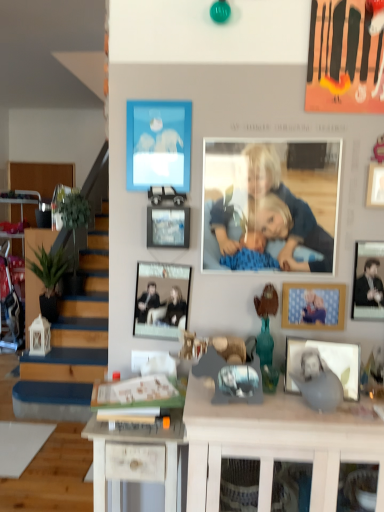
Locate an element on the screen. Image resolution: width=384 pixels, height=512 pixels. free space in front of wooden bear at center is located at coordinates (272, 409).